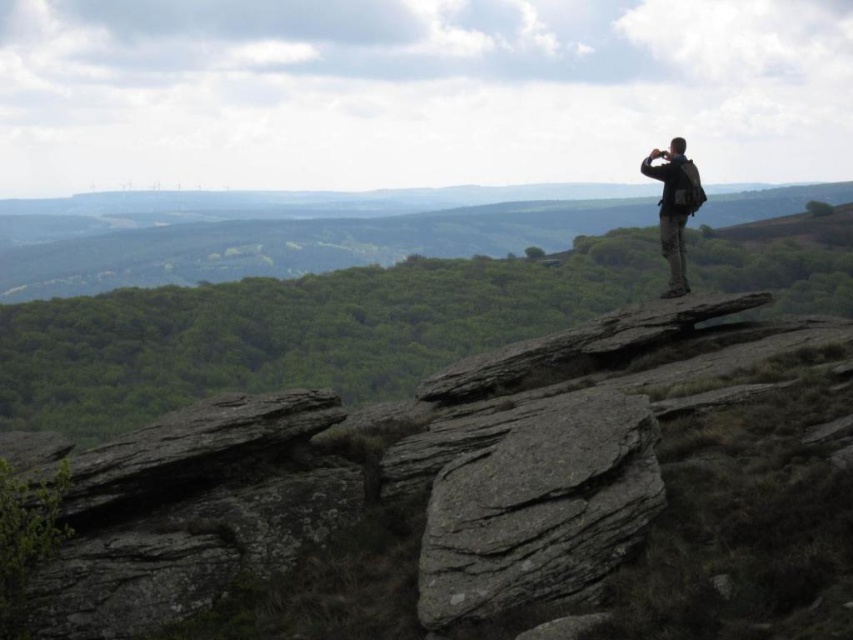
Does gray/rocky stone at center have a greater height compared to camouflage fabric backpack at upper right?

In fact, gray/rocky stone at center may be shorter than camouflage fabric backpack at upper right.

Is point (537, 529) positioned behind point (660, 205)?

No, it is in front of (660, 205).

Who is more distant from viewer, (607,515) or (675,282)?

Positioned behind is point (675,282).

Locate an element on the screen. This screenshot has height=640, width=853. gray/rocky stone at center is located at coordinates (538, 509).